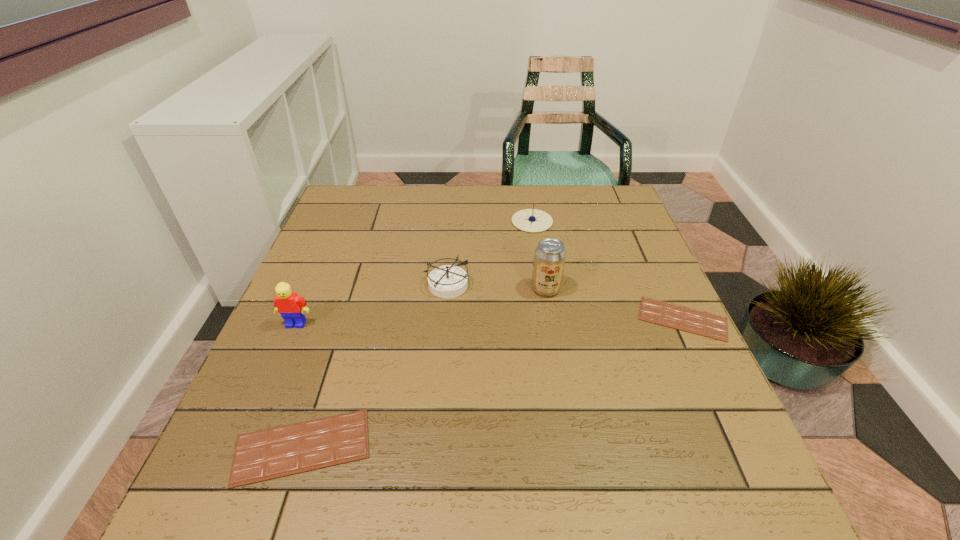
Locate which object ranks fifth in proximity to the nearest object. Please provide its 2D coordinates. Your answer should be formatted as a tuple, i.e. [(x, y)], where the tuple contains the x and y coordinates of a point satisfying the conditions above.

[(530, 220)]

What are the coordinates of `vacant region that satisfies the following two spatial constraints: 1. on the front side of the farther chocolate bar; 2. on the left side of the beer can` in the screenshot? It's located at (551, 319).

Locate an element on the screen. free space that satisfies the following two spatial constraints: 1. on the front-facing side of the Lego; 2. on the left side of the nearer chocolate bar is located at coordinates (244, 447).

Locate an element on the screen. This screenshot has width=960, height=540. free space that satisfies the following two spatial constraints: 1. on the front side of the right compass; 2. on the right side of the beer can is located at coordinates (542, 288).